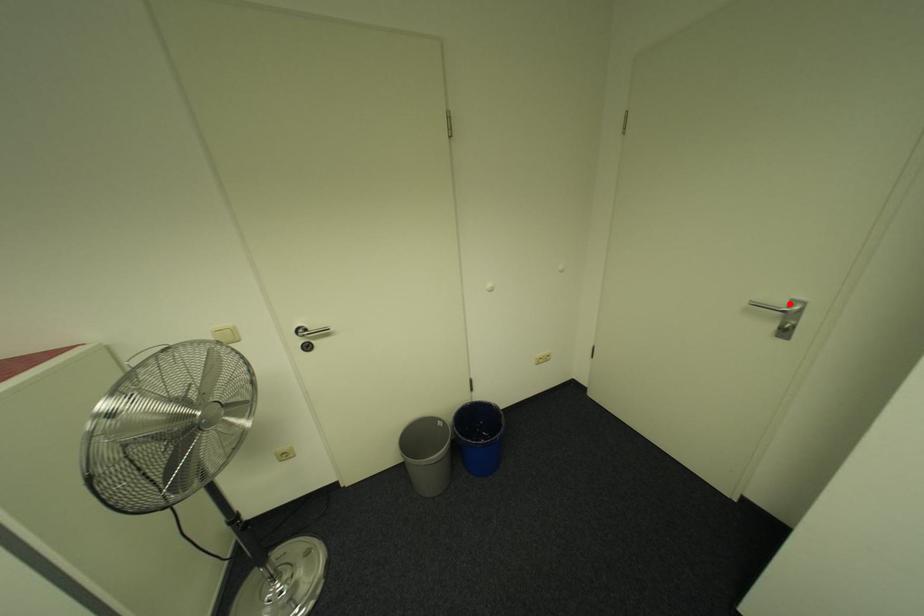
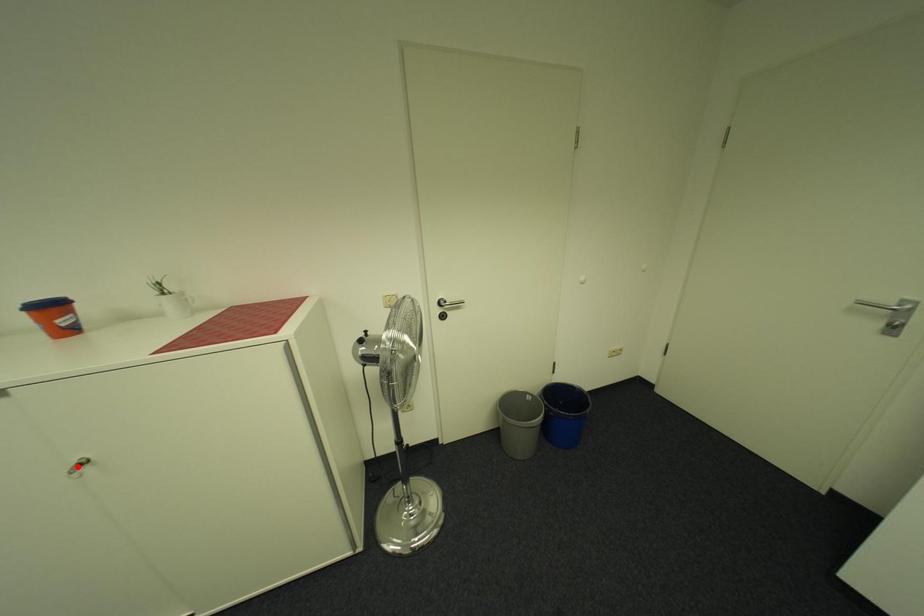
I am providing you with two images of the same scene from different viewpoints. A red point is marked on the first image and another point is marked on the second image. Do the highlighted points in image1 and image2 indicate the same real-world spot?

No